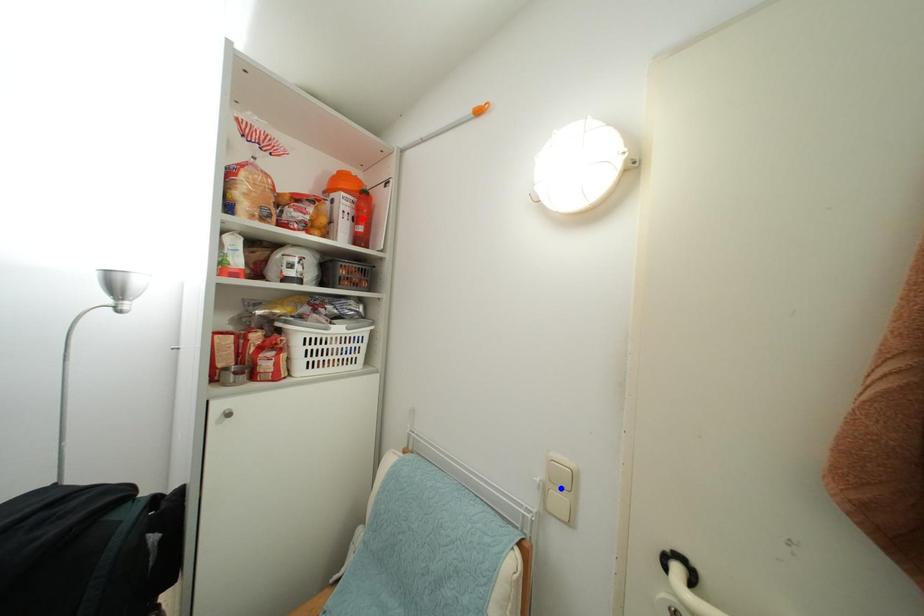
Question: Two points are marked on the image. Which point is closer to the camera?

Choices:
 (A) Blue point is closer.
 (B) Red point is closer.

Answer: (A)